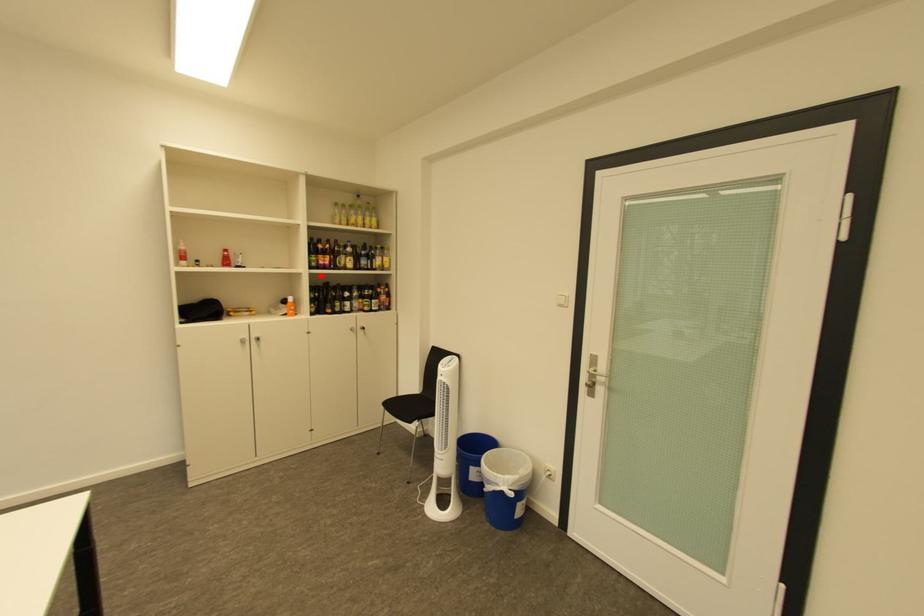
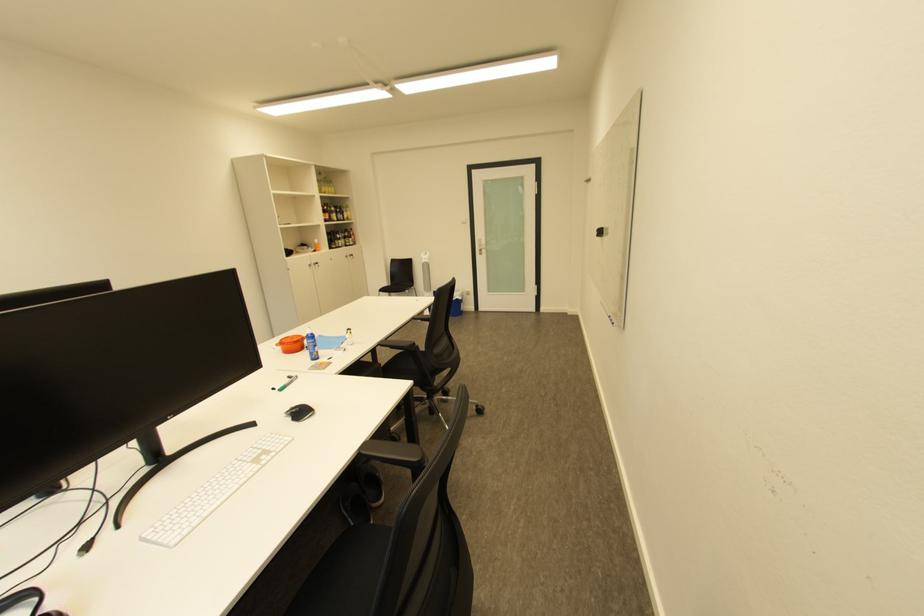
The point at the highlighted location is marked in the first image. Where is the corresponding point in the second image?

(335, 225)